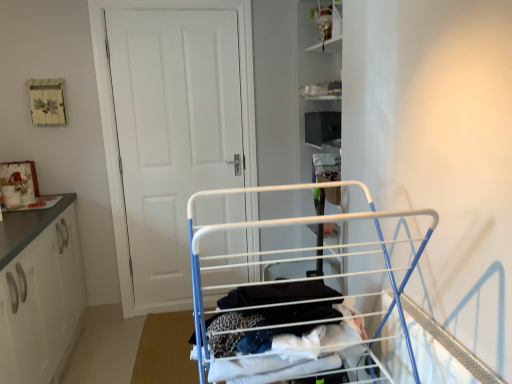
Where is `white matte cabinet at left`? The height and width of the screenshot is (384, 512). white matte cabinet at left is located at coordinates (39, 292).

In order to face matte white cabinet at upper center, should I rotate leftwards or rightwards?

Rotate right and turn 9.162 degrees.

The image size is (512, 384). Describe the element at coordinates (174, 133) in the screenshot. I see `white matte door at center` at that location.

This screenshot has height=384, width=512. What are the coordinates of `white metal drying rack at center` in the screenshot? It's located at (279, 303).

At what (x,y) coordinates should I click in order to perform the action: click on white fabric clothes at center. Please return your answer as a coordinate pair (x, y). The height and width of the screenshot is (384, 512). Looking at the image, I should click on (282, 333).

Considering the relative positions of white fabric clothes at center and white matte door at center in the image provided, is white fabric clothes at center to the left of white matte door at center from the viewer's perspective?

Incorrect, white fabric clothes at center is not on the left side of white matte door at center.

Between point (341, 331) and point (149, 241), which one is positioned behind?

The point (149, 241) is behind.

Does white fabric clothes at center have a greater width compared to white matte door at center?

Yes.

What's the angular difference between white fabric clothes at center and white matte door at center's facing directions?

178 degrees separate the facing orientations of white fabric clothes at center and white matte door at center.

From the image's perspective, does matte white cabinet at upper center appear higher than white metal drying rack at center?

Yes.

Between matte white cabinet at upper center and white metal drying rack at center, which one has smaller size?

matte white cabinet at upper center.

How many degrees apart are the facing directions of white matte cabinet at left and white metal drying rack at center?

They differ by 179 degrees in their facing directions.

From a real-world perspective, is white matte cabinet at left under white metal drying rack at center?

Yes, from a real-world perspective, white matte cabinet at left is under white metal drying rack at center.

Is white matte cabinet at left closer to the viewer compared to white metal drying rack at center?

No, it is behind white metal drying rack at center.

Does white matte cabinet at left have a larger size compared to white metal drying rack at center?

Indeed, white matte cabinet at left has a larger size compared to white metal drying rack at center.

In the scene shown: Considering the positions of objects white metal drying rack at center and white matte cabinet at left in the image provided, who is behind, white metal drying rack at center or white matte cabinet at left?

white matte cabinet at left is more distant.

Based on the photo, is white metal drying rack at center inside the boundaries of white matte cabinet at left, or outside?

white metal drying rack at center is not inside white matte cabinet at left, it's outside.

Does point (295, 353) appear closer or farther from the camera than point (243, 316)?

Point (295, 353).

From a real-world perspective, between white fabric clothes at center and white metal drying rack at center, who is vertically higher?

From a 3D spatial view, white metal drying rack at center is above.

Is white fabric clothes at center not close to white metal drying rack at center?

white fabric clothes at center is near white metal drying rack at center, not far away.

Who is smaller, white fabric clothes at center or white metal drying rack at center?

white fabric clothes at center is smaller.

Is white matte door at center bigger than matte white cabinet at upper center?

Indeed, white matte door at center has a larger size compared to matte white cabinet at upper center.

From a real-world perspective, does white matte door at center stand above matte white cabinet at upper center?

No, from a real-world perspective, white matte door at center is not above matte white cabinet at upper center.

Between white matte door at center and matte white cabinet at upper center, which one has more height?

Standing taller between the two is white matte door at center.

I want to click on cabinetry in front of the white matte door at center, so click(x=39, y=292).

Is white matte cabinet at left positioned before white matte door at center?

Yes, it is.

Are white matte cabinet at left and white matte door at center far apart?

That's not correct — white matte cabinet at left is a little close to white matte door at center.

Locate an element on the screen. clothing in front of the white matte door at center is located at coordinates (282, 333).

Find the location of a particular element. The image size is (512, 384). cabinet located on the right of white metal drying rack at center is located at coordinates (326, 20).

When comparing their distances from matte white cabinet at upper center, does white matte door at center or white matte cabinet at left seem closer?

white matte door at center lies closer to matte white cabinet at upper center than the other object.

Considering their positions, is white matte door at center positioned closer to matte white cabinet at upper center than white fabric clothes at center?

white matte door at center is closer to matte white cabinet at upper center.

Based on their spatial positions, is white metal drying rack at center or white fabric clothes at center further from white matte door at center?

white fabric clothes at center is positioned further to the anchor white matte door at center.

From the image, which object appears to be nearer to matte white cabinet at upper center, white metal drying rack at center or white matte door at center?

The object closer to matte white cabinet at upper center is white matte door at center.

Estimate the real-world distances between objects in this image. Which object is closer to white matte door at center, white metal drying rack at center or matte white cabinet at upper center?

Based on the image, matte white cabinet at upper center appears to be nearer to white matte door at center.

Based on their spatial positions, is white metal drying rack at center or white fabric clothes at center closer to matte white cabinet at upper center?

white metal drying rack at center.

Based on their spatial positions, is white matte cabinet at left or white metal drying rack at center further from matte white cabinet at upper center?

The object further to matte white cabinet at upper center is white matte cabinet at left.

Which object lies nearer to the anchor point white matte cabinet at left, white metal drying rack at center or white fabric clothes at center?

white fabric clothes at center.

At what (x,y) coordinates should I click in order to perform the action: click on clothing between white matte cabinet at left and matte white cabinet at upper center from left to right. Please return your answer as a coordinate pair (x, y). The image size is (512, 384). Looking at the image, I should click on (282, 333).

Where is `cabinetry between white metal drying rack at center and white matte door at center in the front-back direction`? The height and width of the screenshot is (384, 512). cabinetry between white metal drying rack at center and white matte door at center in the front-back direction is located at coordinates (39, 292).

The image size is (512, 384). I want to click on baby carriage between white matte cabinet at left and matte white cabinet at upper center, so click(x=279, y=303).

Where is `door between matte white cabinet at upper center and white fabric clothes at center in the up-down direction`? door between matte white cabinet at upper center and white fabric clothes at center in the up-down direction is located at coordinates (174, 133).